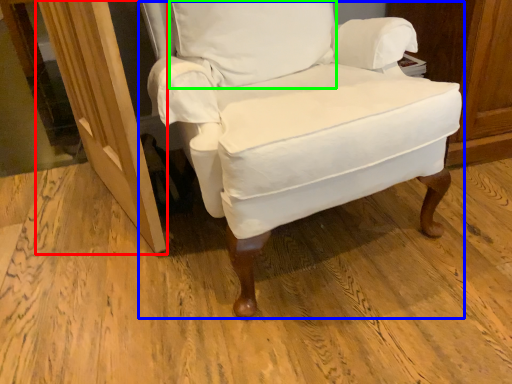
Question: Estimate the real-world distances between objects in this image. Which object is closer to screen door (highlighted by a red box), chair (highlighted by a blue box) or pillow (highlighted by a green box)?

Choices:
 (A) chair
 (B) pillow

Answer: (A)